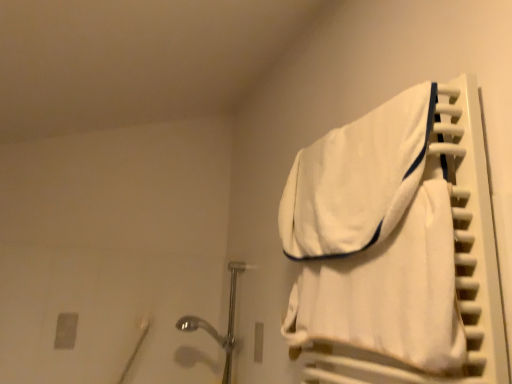
What do you see at coordinates (389, 292) in the screenshot?
I see `white cotton towel at upper right` at bounding box center [389, 292].

You are a GUI agent. You are given a task and a screenshot of the screen. Output one action in this format:
    pyautogui.click(x=<x>, y=<y>)
    Task: Click on the white cotton towel at upper right
    Image resolution: width=512 pixels, height=384 pixels.
    Given the screenshot: What is the action you would take?
    pyautogui.click(x=389, y=292)

Locate an element on the screen. The width and height of the screenshot is (512, 384). white cotton towel at upper right is located at coordinates (389, 292).